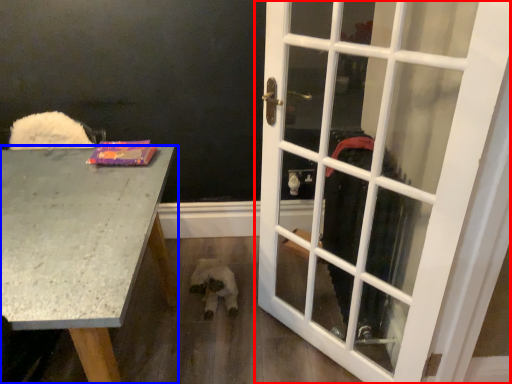
Question: Which of the following is the closest to the observer, door (highlighted by a red box) or desk (highlighted by a blue box)?

Choices:
 (A) door
 (B) desk

Answer: (B)